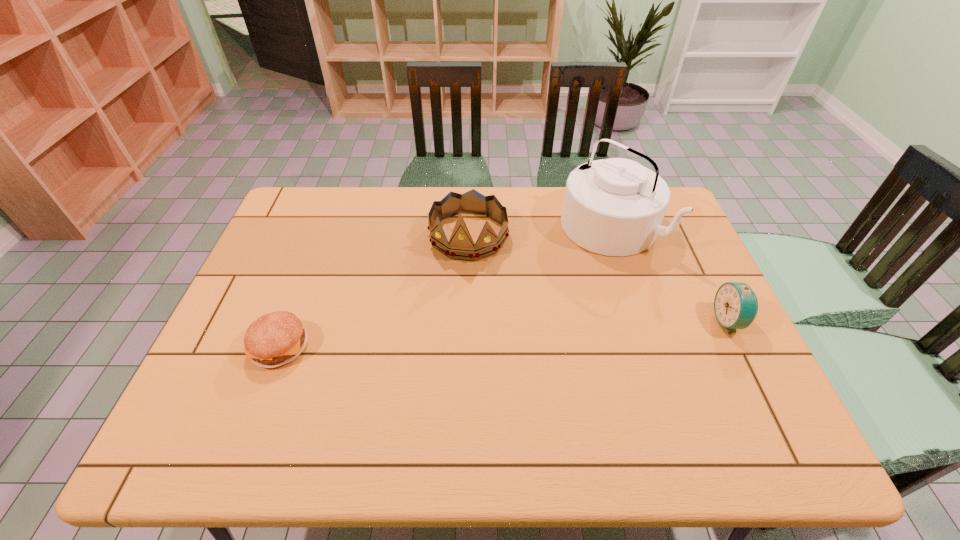
The height and width of the screenshot is (540, 960). Find the location of `vacant space located 0.210m on the front-facing side of the rightmost object`. vacant space located 0.210m on the front-facing side of the rightmost object is located at coordinates (635, 321).

Find the location of a particular element. The image size is (960, 540). vacant space located 0.220m on the front-facing side of the rightmost object is located at coordinates (631, 321).

You are a GUI agent. You are given a task and a screenshot of the screen. Output one action in this format:
    pyautogui.click(x=<x>, y=<y>)
    Task: Click on the vacant space located 0.250m on the spout of the second object from right to left
    This screenshot has height=540, width=960.
    Given the screenshot: What is the action you would take?
    pyautogui.click(x=521, y=291)

This screenshot has width=960, height=540. I want to click on free space located 0.170m on the spout of the second object from right to left, so point(541,277).

Locate an element on the screen. The width and height of the screenshot is (960, 540). free space located on the spout of the second object from right to left is located at coordinates (534, 282).

Identify the location of vacant space situated 0.380m at the front of the third object from right to left with jewels. This screenshot has height=540, width=960. (435, 375).

Image resolution: width=960 pixels, height=540 pixels. Find the location of `vacant position located 0.300m at the front of the third object from right to left with jewels`. vacant position located 0.300m at the front of the third object from right to left with jewels is located at coordinates (442, 348).

Locate an element on the screen. This screenshot has width=960, height=540. vacant space located 0.400m at the front of the third object from right to left with jewels is located at coordinates (433, 383).

At what (x,y) coordinates should I click in order to perform the action: click on kettle that is at the far edge. Please return your answer as a coordinate pair (x, y). Looking at the image, I should click on (615, 207).

This screenshot has width=960, height=540. I want to click on tiara at the far edge, so click(461, 246).